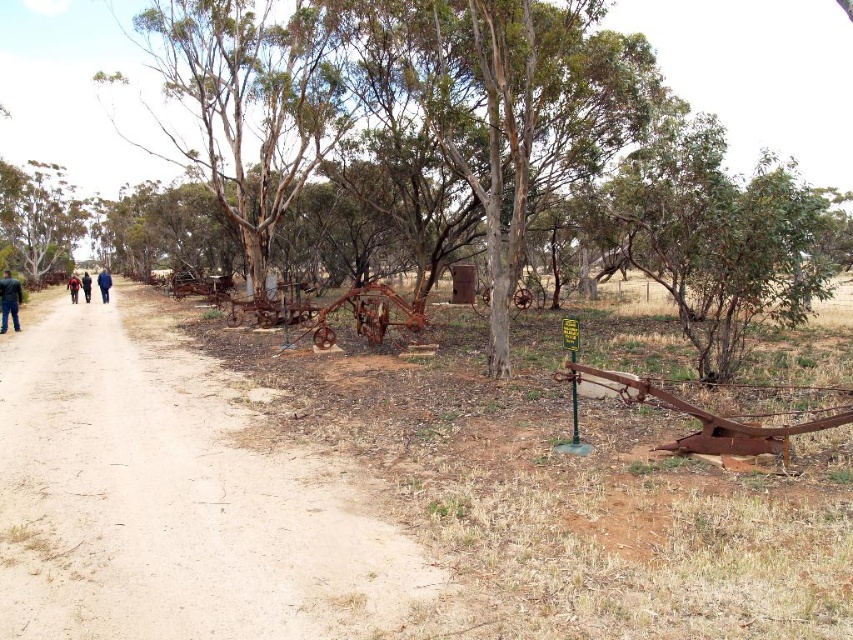
Who is positioned more to the left, rusty metal plow at center-right or dark blue jeans at left?

Positioned to the left is dark blue jeans at left.

Does point (495, 497) come in front of point (71, 289)?

Yes, it is.

Locate an element on the screen. The image size is (853, 640). rusty metal plow at center-right is located at coordinates (572, 499).

Who is more forward, [107,275] or [78,278]?

Positioned in front is point [107,275].

Does dark blue jeans at center come in front of dark blue jeans at left?

No, it is not.

You are a GUI agent. You are given a task and a screenshot of the screen. Output one action in this format:
    pyautogui.click(x=<x>, y=<y>)
    Task: Click on the dark blue jeans at center
    This screenshot has width=853, height=640.
    Given the screenshot: What is the action you would take?
    pyautogui.click(x=103, y=284)

Locate an element on the screen. dark blue jeans at center is located at coordinates (103, 284).

Between point (497, 512) and point (195, 465), which one is positioned in front?

Point (497, 512) is in front.

Can you confirm if rusty metal plow at center-right is positioned above brown dirt path at center?

Incorrect, rusty metal plow at center-right is not positioned above brown dirt path at center.

Where is `rusty metal plow at center-right`? The height and width of the screenshot is (640, 853). rusty metal plow at center-right is located at coordinates (572, 499).

The image size is (853, 640). I want to click on rusty metal plow at center-right, so click(572, 499).